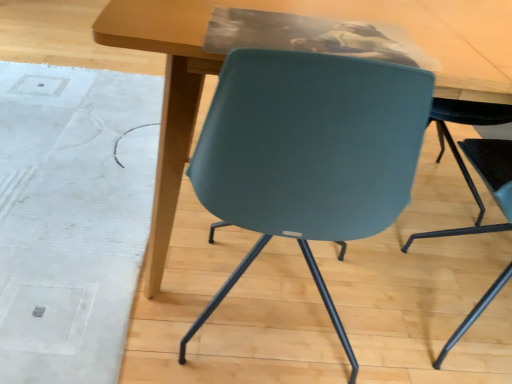
Image resolution: width=512 pixels, height=384 pixels. What do you see at coordinates (71, 217) in the screenshot?
I see `white textured mat at lower left` at bounding box center [71, 217].

Locate an element on the screen. Image resolution: width=512 pixels, height=384 pixels. matte wood table at center is located at coordinates (298, 13).

Which is in front, point (488, 228) or point (135, 139)?

The point (488, 228) is more forward.

Is teal plastic chair at lower right to the left of white textured mat at lower left from the viewer's perspective?

Incorrect, teal plastic chair at lower right is not on the left side of white textured mat at lower left.

From the image's perspective, is teal plastic chair at lower right located above or below white textured mat at lower left?

Based on their image positions, teal plastic chair at lower right is located beneath white textured mat at lower left.

Could you tell me if teal plastic chair at lower right is facing white textured mat at lower left?

No, teal plastic chair at lower right is not oriented towards white textured mat at lower left.

Which of these two, white textured mat at lower left or teal plastic chair at lower right, is wider?

With larger width is white textured mat at lower left.

Measure the distance from white textured mat at lower left to teal plastic chair at lower right.

They are 4.33 feet apart.

Is white textured mat at lower left located outside teal plastic chair at lower right?

Yes, white textured mat at lower left is not within teal plastic chair at lower right.

From the image's perspective, is white textured mat at lower left positioned above or below teal plastic chair at lower right?

white textured mat at lower left is situated higher than teal plastic chair at lower right in the image.

Between white textured mat at lower left and matte wood table at center, which one is positioned behind?

white textured mat at lower left is further away from the camera.

From a real-world perspective, is white textured mat at lower left physically located above or below matte wood table at center?

Clearly, from a real-world perspective, white textured mat at lower left is below matte wood table at center.

Considering the relative positions of white textured mat at lower left and matte wood table at center in the image provided, is white textured mat at lower left to the left of matte wood table at center from the viewer's perspective?

Yes, white textured mat at lower left is to the left of matte wood table at center.

Can you confirm if matte wood table at center is smaller than teal plastic chair at lower right?

No.

Is matte wood table at center at the left side of teal plastic chair at lower right?

Yes.

Identify the location of chair below the matte wood table at center (from the image's perspective). The image size is (512, 384). (485, 182).

How much distance is there between matte wood table at center and teal plastic chair at lower right?

matte wood table at center and teal plastic chair at lower right are 20.75 inches apart.

Does matte wood table at center contain white textured mat at lower left?

No, white textured mat at lower left is not surrounded by matte wood table at center.

Are matte wood table at center and white textured mat at lower left far apart?

No, matte wood table at center is not far from white textured mat at lower left.

From the image's perspective, would you say matte wood table at center is shown under white textured mat at lower left?

Actually, matte wood table at center appears above white textured mat at lower left in the image.

In the scene shown: Which point is more distant from viewer, (440,79) or (60,162)?

The point (60,162) is more distant.

From their relative heights in the image, would you say teal plastic chair at lower right is taller or shorter than matte wood table at center?

In the image, teal plastic chair at lower right appears to be taller than matte wood table at center.

From a real-world perspective, is teal plastic chair at lower right physically located above or below matte wood table at center?

Clearly, from a real-world perspective, teal plastic chair at lower right is above matte wood table at center.

Is teal plastic chair at lower right facing away from matte wood table at center?

Yes, teal plastic chair at lower right is positioned with its back facing matte wood table at center.

Who is more distant, teal plastic chair at lower right or matte wood table at center?

Positioned behind is matte wood table at center.

The height and width of the screenshot is (384, 512). I want to click on mat on the left side of teal plastic chair at lower right, so (x=71, y=217).

I want to click on mat lying behind the teal plastic chair at lower right, so 71,217.

Which object lies nearer to the anchor point matte wood table at center, teal plastic chair at lower right or white textured mat at lower left?

teal plastic chair at lower right is positioned closer to the anchor matte wood table at center.

When comparing their distances from matte wood table at center, does white textured mat at lower left or teal plastic chair at lower right seem further?

white textured mat at lower left.

From the image, which object appears to be farther from teal plastic chair at lower right, matte wood table at center or white textured mat at lower left?

white textured mat at lower left.

Looking at the image, which one is located further to white textured mat at lower left, matte wood table at center or teal plastic chair at lower right?

The object further to white textured mat at lower left is teal plastic chair at lower right.

Based on their spatial positions, is teal plastic chair at lower right or matte wood table at center closer to white textured mat at lower left?

matte wood table at center lies closer to white textured mat at lower left than the other object.

Estimate the real-world distances between objects in this image. Which object is further from teal plastic chair at lower right, white textured mat at lower left or matte wood table at center?

Among the two, white textured mat at lower left is located further to teal plastic chair at lower right.

Find the location of `table located between white textured mat at lower left and teal plastic chair at lower right in the left-right direction`. table located between white textured mat at lower left and teal plastic chair at lower right in the left-right direction is located at coordinates (298, 13).